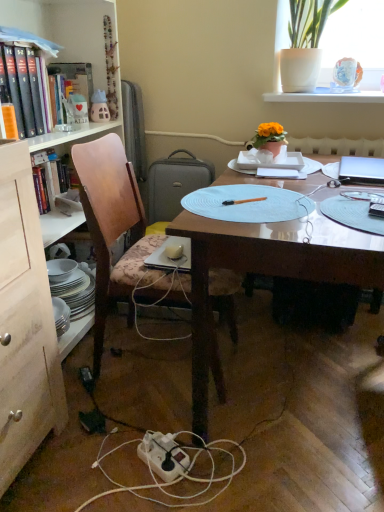
This screenshot has height=512, width=384. In order to click on vacant area that is in front of white plastic power plugs and sockets at lower center, which appears as the 1th power plugs and sockets when viewed from the front in this screenshot , I will do `click(82, 467)`.